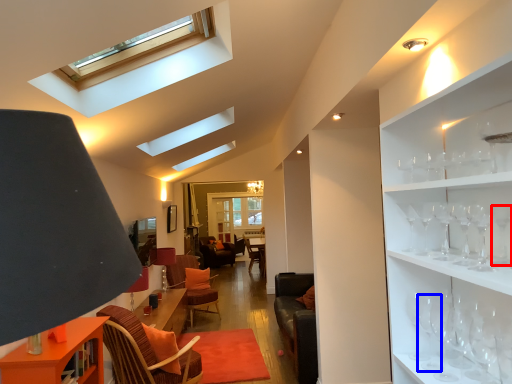
Question: Which object appears closest to the camera in this image, wine glass (highlighted by a red box) or wine glass (highlighted by a blue box)?

Choices:
 (A) wine glass
 (B) wine glass

Answer: (A)